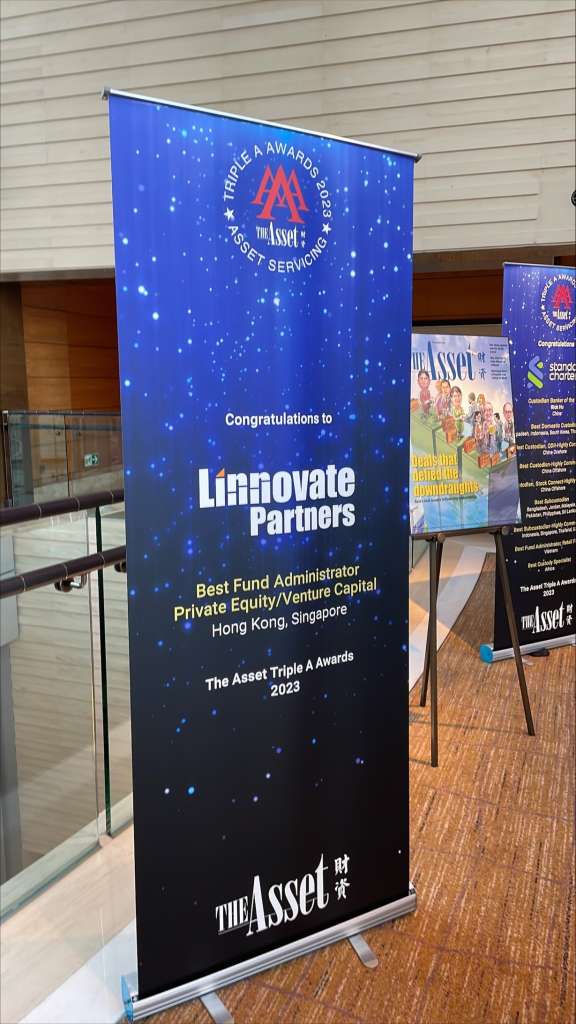
Locate an element on the screen. This screenshot has width=576, height=1024. brown carpet is located at coordinates (504, 935).